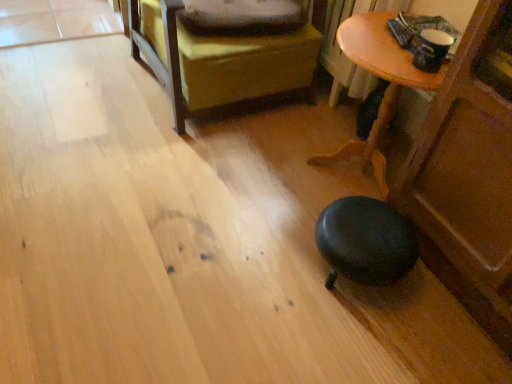
The image size is (512, 384). Find the location of `blank space situated above wooden table at lower right (from a real-world perspective)`. blank space situated above wooden table at lower right (from a real-world perspective) is located at coordinates (390, 39).